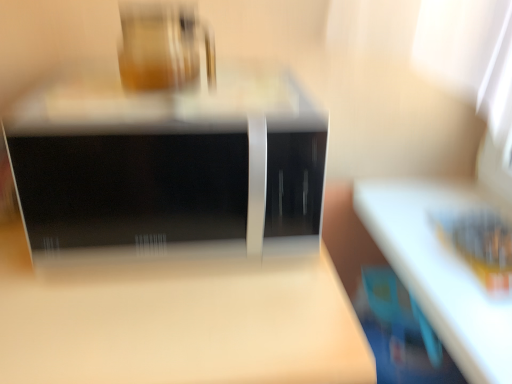
Question: Is matte glass jar at upper center positioned beyond the bounds of matte wood table at center?

Choices:
 (A) yes
 (B) no

Answer: (A)

Question: From the image's perspective, is matte glass jar at upper center located beneath matte wood table at center?

Choices:
 (A) yes
 (B) no

Answer: (B)

Question: Is matte wood table at center at the back of matte glass jar at upper center?

Choices:
 (A) no
 (B) yes

Answer: (A)

Question: From the image's perspective, is matte glass jar at upper center on matte wood table at center?

Choices:
 (A) yes
 (B) no

Answer: (A)

Question: Considering the relative sizes of matte glass jar at upper center and matte wood table at center in the image provided, is matte glass jar at upper center smaller than matte wood table at center?

Choices:
 (A) no
 (B) yes

Answer: (B)

Question: Is matte glass jar at upper center not close to matte wood table at center?

Choices:
 (A) yes
 (B) no

Answer: (B)

Question: Considering the relative sizes of matte wood table at center and matte glass jar at upper center in the image provided, is matte wood table at center wider than matte glass jar at upper center?

Choices:
 (A) no
 (B) yes

Answer: (B)

Question: Does matte wood table at center have a lesser width compared to matte glass jar at upper center?

Choices:
 (A) yes
 (B) no

Answer: (B)

Question: Is matte wood table at center at the left side of matte glass jar at upper center?

Choices:
 (A) yes
 (B) no

Answer: (A)

Question: Is matte glass jar at upper center surrounded by matte wood table at center?

Choices:
 (A) yes
 (B) no

Answer: (B)

Question: From a real-world perspective, is matte wood table at center located higher than matte glass jar at upper center?

Choices:
 (A) yes
 (B) no

Answer: (B)

Question: Could you tell me if matte wood table at center is turned towards matte glass jar at upper center?

Choices:
 (A) no
 (B) yes

Answer: (A)

Question: Is matte glass jar at upper center facing towards black glossy microwave at center?

Choices:
 (A) no
 (B) yes

Answer: (A)